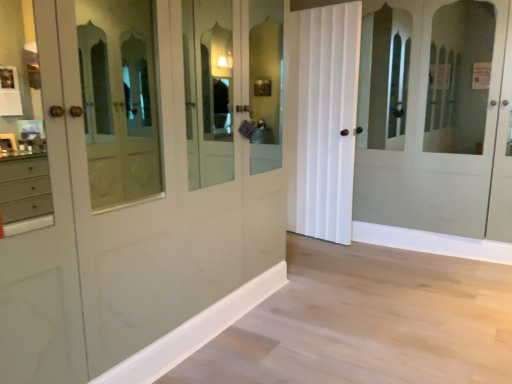
Question: Can you confirm if white wood molding at lower center is positioned to the left of white matte door at center?

Choices:
 (A) yes
 (B) no

Answer: (A)

Question: Is white wood molding at lower center next to white matte door at center?

Choices:
 (A) no
 (B) yes

Answer: (A)

Question: Can you confirm if white wood molding at lower center is bigger than white matte door at center?

Choices:
 (A) no
 (B) yes

Answer: (A)

Question: Does white wood molding at lower center turn towards white matte door at center?

Choices:
 (A) yes
 (B) no

Answer: (B)

Question: Could white matte door at center be considered to be inside white wood molding at lower center?

Choices:
 (A) yes
 (B) no

Answer: (B)

Question: From a real-world perspective, is white wood molding at lower center located higher than white matte door at center?

Choices:
 (A) yes
 (B) no

Answer: (B)

Question: Does white matte door at center have a larger size compared to white wood molding at lower center?

Choices:
 (A) no
 (B) yes

Answer: (B)

Question: Would you say white matte door at center is outside white wood molding at lower center?

Choices:
 (A) yes
 (B) no

Answer: (A)

Question: From the image's perspective, is white matte door at center located beneath white wood molding at lower center?

Choices:
 (A) no
 (B) yes

Answer: (A)

Question: Could white wood molding at lower center be considered to be inside white matte door at center?

Choices:
 (A) no
 (B) yes

Answer: (A)

Question: Could you tell me if white matte door at center is facing white wood molding at lower center?

Choices:
 (A) yes
 (B) no

Answer: (A)

Question: From a real-world perspective, is white matte door at center located beneath white wood molding at lower center?

Choices:
 (A) no
 (B) yes

Answer: (A)

Question: Is white wood molding at lower center bigger or smaller than white matte door at center?

Choices:
 (A) small
 (B) big

Answer: (A)